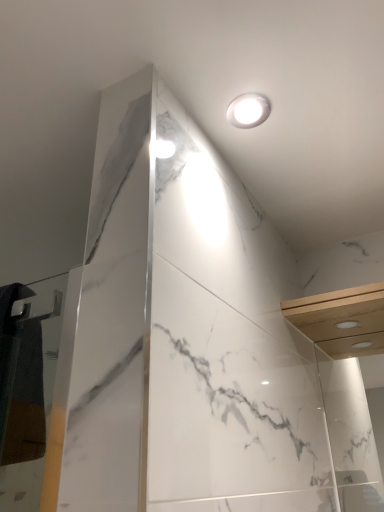
The height and width of the screenshot is (512, 384). In order to click on free space behind white glossy light fixture at upper center in this screenshot , I will do `click(260, 156)`.